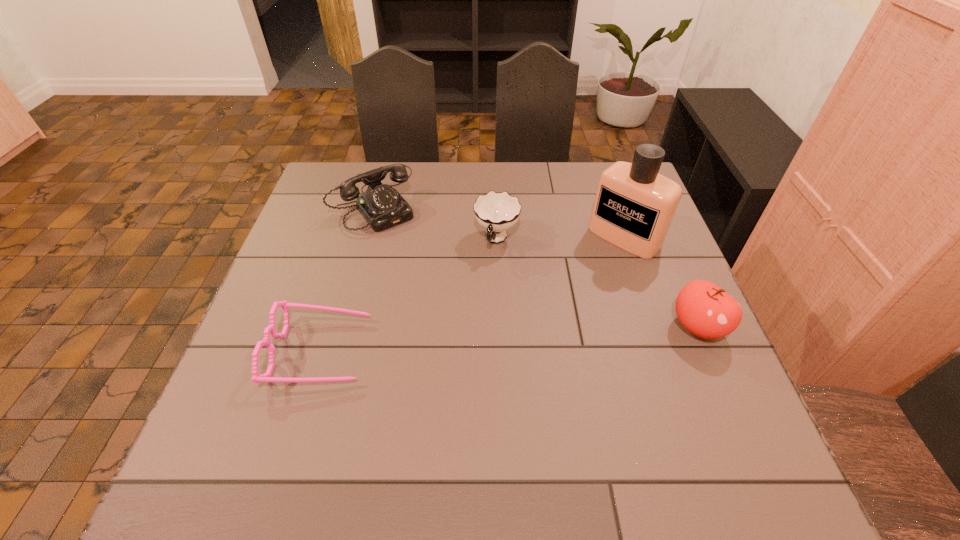
The width and height of the screenshot is (960, 540). In order to click on free space on the desktop that is between the shortest object and the apple and is positioned on the front label of the perfume in this screenshot , I will do `click(518, 339)`.

Identify the location of free space on the desktop that is between the shortest object and the apple and is positioned on the side of the cup with the handle. Image resolution: width=960 pixels, height=540 pixels. (462, 342).

You are a GUI agent. You are given a task and a screenshot of the screen. Output one action in this format:
    pyautogui.click(x=<x>, y=<y>)
    Task: Click on the vacant spot on the desktop that is between the shortest object and the apple and is positioned on the front-facing side of the telephone
    
    Given the screenshot: What is the action you would take?
    pyautogui.click(x=498, y=340)